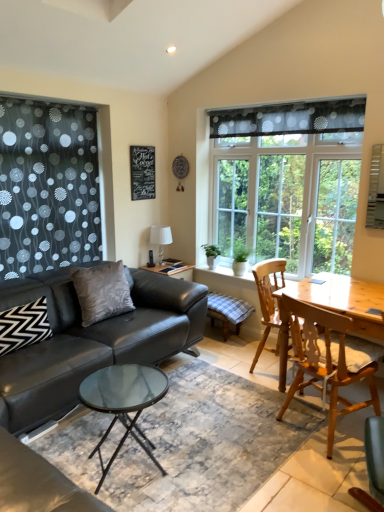
Question: Is the depth of matte black chair at lower right, which is the 3th chair in back-to-front order, greater than that of wooden chair at right, acting as the 1th chair starting from the back?

Choices:
 (A) no
 (B) yes

Answer: (A)

Question: Does matte black chair at lower right, the first chair in the front-to-back sequence, appear on the right side of wooden chair at right, placed as the 3th chair when sorted from front to back?

Choices:
 (A) yes
 (B) no

Answer: (A)

Question: Is matte black chair at lower right, the first chair in the front-to-back sequence, touching wooden chair at right, placed as the 3th chair when sorted from front to back?

Choices:
 (A) no
 (B) yes

Answer: (A)

Question: Can you confirm if matte black chair at lower right, which is the 3th chair in back-to-front order, is positioned to the left of wooden chair at right, placed as the 3th chair when sorted from front to back?

Choices:
 (A) no
 (B) yes

Answer: (A)

Question: Is matte black chair at lower right, the first chair in the front-to-back sequence, aimed at wooden chair at right, placed as the 3th chair when sorted from front to back?

Choices:
 (A) no
 (B) yes

Answer: (A)

Question: Based on their sizes in the image, would you say wooden chair at right, placed as the 3th chair when sorted from front to back, is bigger or smaller than clear glass window at center?

Choices:
 (A) big
 (B) small

Answer: (B)

Question: Is point (258, 288) closer or farther from the camera than point (334, 168)?

Choices:
 (A) farther
 (B) closer

Answer: (B)

Question: Do you think wooden chair at right, acting as the 1th chair starting from the back, is within clear glass window at center, or outside of it?

Choices:
 (A) outside
 (B) inside

Answer: (A)

Question: Visually, is wooden chair at right, placed as the 3th chair when sorted from front to back, positioned to the left or to the right of clear glass window at center?

Choices:
 (A) left
 (B) right

Answer: (A)

Question: Is point (160, 240) positioned closer to the camera than point (284, 165)?

Choices:
 (A) closer
 (B) farther

Answer: (B)

Question: Looking at their shapes, would you say white glossy lampshade at upper center is wider or thinner than clear glass window at center?

Choices:
 (A) thin
 (B) wide

Answer: (B)

Question: Do you think white glossy lampshade at upper center is within clear glass window at center, or outside of it?

Choices:
 (A) outside
 (B) inside

Answer: (A)

Question: In terms of height, does white glossy lampshade at upper center look taller or shorter compared to clear glass window at center?

Choices:
 (A) short
 (B) tall

Answer: (A)

Question: Based on their positions, is matte black chair at lower right, the first chair in the front-to-back sequence, located to the left or right of satin gray pillow at center, marked as the second pillow in a front-to-back arrangement?

Choices:
 (A) left
 (B) right

Answer: (B)

Question: In terms of size, does matte black chair at lower right, which is the 3th chair in back-to-front order, appear bigger or smaller than satin gray pillow at center, which is the first pillow from right to left?

Choices:
 (A) small
 (B) big

Answer: (A)